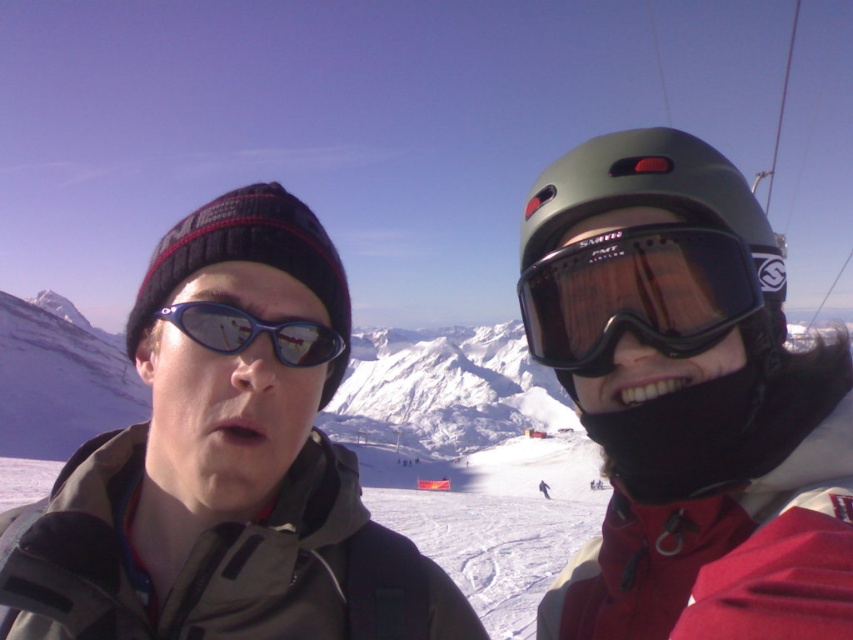
Between green matte helmet at upper right and shiny blue plastic goggles at left, which one appears on the right side from the viewer's perspective?

green matte helmet at upper right

Who is shorter, green matte helmet at upper right or shiny blue plastic goggles at left?

shiny blue plastic goggles at left

Between point (646, 176) and point (306, 321), which one is positioned in front?

Point (646, 176) is more forward.

Locate an element on the screen. This screenshot has height=640, width=853. green matte helmet at upper right is located at coordinates (651, 196).

Between black matte goggles at upper right and shiny blue plastic goggles at left, which one appears on the left side from the viewer's perspective?

shiny blue plastic goggles at left

Measure the distance between black matte goggles at upper right and camera.

black matte goggles at upper right and camera are 65.55 meters apart from each other.

At what (x,y) coordinates should I click in order to perform the action: click on black matte goggles at upper right. Please return your answer as a coordinate pair (x, y). The width and height of the screenshot is (853, 640). Looking at the image, I should click on (636, 294).

Between point (601, 356) and point (723, 186), which one is positioned behind?

The point (601, 356) is more distant.

In the scene shown: Which of these two, black matte goggles at upper right or green matte helmet at upper right, stands shorter?

With less height is black matte goggles at upper right.

Who is more forward, (x=616, y=246) or (x=735, y=202)?

Positioned in front is point (x=616, y=246).

This screenshot has height=640, width=853. What are the coordinates of `black matte goggles at upper right` in the screenshot? It's located at 636,294.